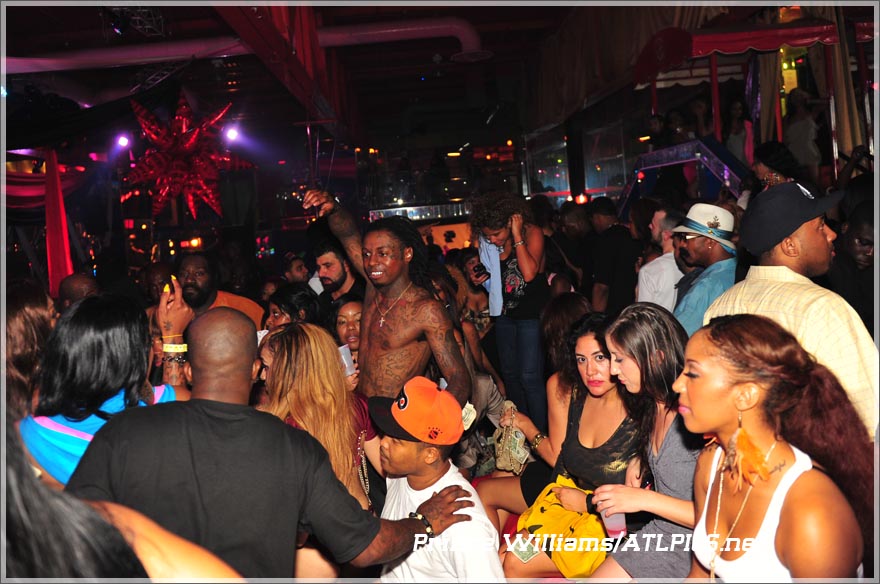
The width and height of the screenshot is (880, 584). I want to click on stairway, so click(753, 180), click(715, 142), click(672, 135).